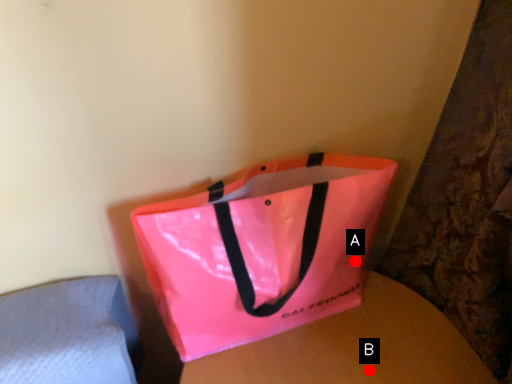
Question: Two points are circled on the image, labeled by A and B beside each circle. Which point is closer to the camera taking this photo?

Choices:
 (A) A is closer
 (B) B is closer

Answer: (B)